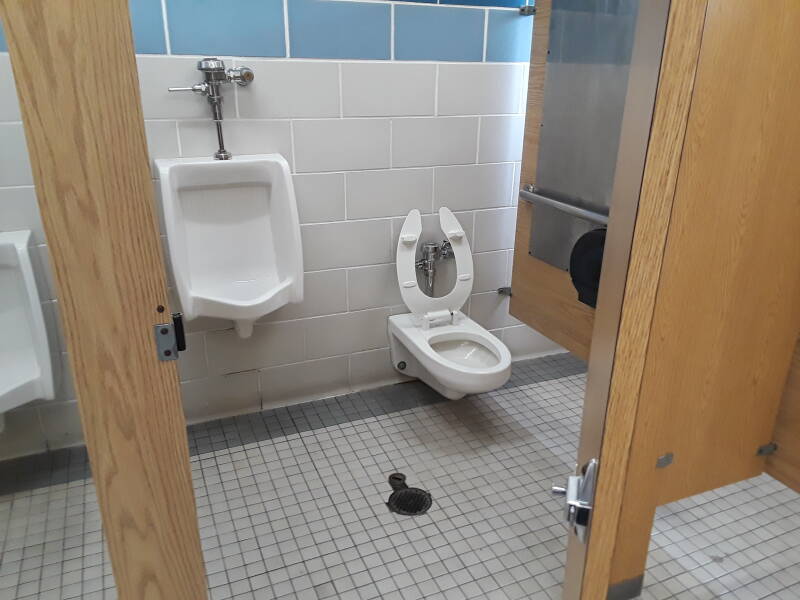
At what (x,y) coordinates should I click in order to perform the action: click on urinals. Please return your answer as a coordinate pair (x, y). The image size is (800, 600). Looking at the image, I should click on (260, 217), (12, 333).